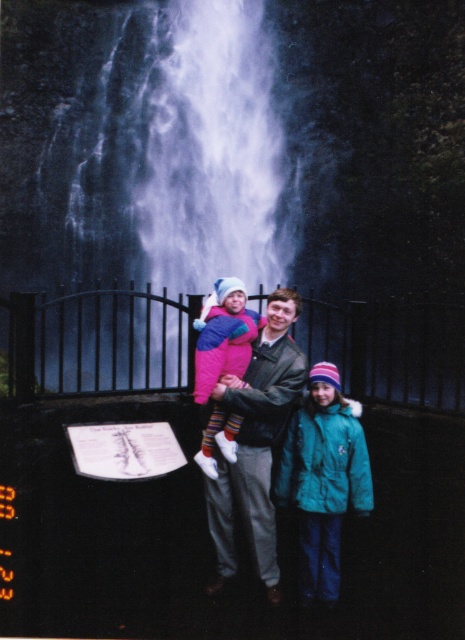
You are a photographer trying to capture the family in the image. You want to ensure the white frothy water at upper center and the matte pink jacket at center are both visible in your shot. Based on their positions, which object is closer to the left edge of the frame?

The white frothy water at upper center is to the left of the matte pink jacket at center, so it is closer to the left edge of the frame.

In the scene shown: You are a photographer trying to capture a photo of the family while ensuring the black metal fence at center and the leather jacket at center are both in the frame. Based on their positions, which object should you position closer to the left side of the camera frame?

The black metal fence at center should be positioned closer to the left side of the camera frame since it is to the left of the leather jacket at center.